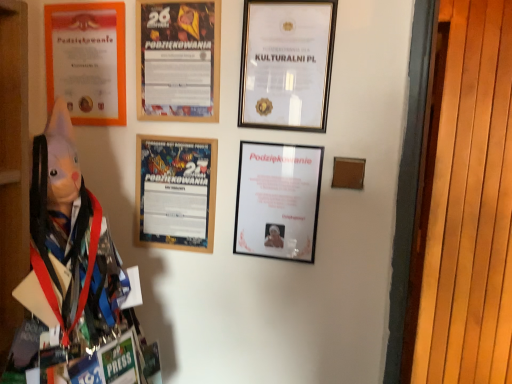
Question: Is wooden framed poster at center, which is counted as the 2th picture frame, starting from the left, positioned beyond the bounds of matte orange certificate at upper left, the fourth picture frame in the right-to-left sequence?

Choices:
 (A) yes
 (B) no

Answer: (A)

Question: Could you tell me if wooden framed poster at center, positioned as the 3th picture frame in right-to-left order, is facing matte orange certificate at upper left, the fourth picture frame in the right-to-left sequence?

Choices:
 (A) no
 (B) yes

Answer: (A)

Question: Is wooden framed poster at center, which is counted as the 2th picture frame, starting from the left, wider than matte orange certificate at upper left, the first picture frame from the left?

Choices:
 (A) no
 (B) yes

Answer: (A)

Question: From a real-world perspective, is wooden framed poster at center, positioned as the 3th picture frame in right-to-left order, physically above matte orange certificate at upper left, the fourth picture frame in the right-to-left sequence?

Choices:
 (A) yes
 (B) no

Answer: (B)

Question: Considering the relative positions of wooden framed poster at center, which is counted as the 2th picture frame, starting from the left, and matte orange certificate at upper left, the first picture frame from the left, in the image provided, is wooden framed poster at center, which is counted as the 2th picture frame, starting from the left, to the left of matte orange certificate at upper left, the first picture frame from the left, from the viewer's perspective?

Choices:
 (A) yes
 (B) no

Answer: (B)

Question: Is wooden framed poster at center, which is counted as the 2th picture frame, starting from the left, thinner than matte orange certificate at upper left, the fourth picture frame in the right-to-left sequence?

Choices:
 (A) yes
 (B) no

Answer: (A)

Question: Is gold-framed certificate at upper center, the fourth picture frame in the left-to-right sequence, completely or partially inside wooden framed poster at center, which is counted as the 2th picture frame, starting from the left?

Choices:
 (A) no
 (B) yes

Answer: (A)

Question: Could you tell me if wooden framed poster at center, positioned as the 3th picture frame in right-to-left order, is facing gold-framed certificate at upper center, placed as the first picture frame when sorted from right to left?

Choices:
 (A) no
 (B) yes

Answer: (A)

Question: Does wooden framed poster at center, positioned as the 3th picture frame in right-to-left order, lie in front of gold-framed certificate at upper center, placed as the first picture frame when sorted from right to left?

Choices:
 (A) yes
 (B) no

Answer: (B)

Question: From the image's perspective, does wooden framed poster at center, positioned as the 3th picture frame in right-to-left order, appear higher than gold-framed certificate at upper center, the fourth picture frame in the left-to-right sequence?

Choices:
 (A) no
 (B) yes

Answer: (A)

Question: Is wooden framed poster at center, positioned as the 3th picture frame in right-to-left order, to the left of gold-framed certificate at upper center, placed as the first picture frame when sorted from right to left, from the viewer's perspective?

Choices:
 (A) yes
 (B) no

Answer: (A)

Question: Is wooden framed poster at center, positioned as the 3th picture frame in right-to-left order, placed right next to gold-framed certificate at upper center, the fourth picture frame in the left-to-right sequence?

Choices:
 (A) yes
 (B) no

Answer: (B)

Question: Can you confirm if gold-framed certificate at upper center, placed as the first picture frame when sorted from right to left, is positioned to the left of matte black picture frame at center, the 2th picture frame when ordered from right to left?

Choices:
 (A) no
 (B) yes

Answer: (A)